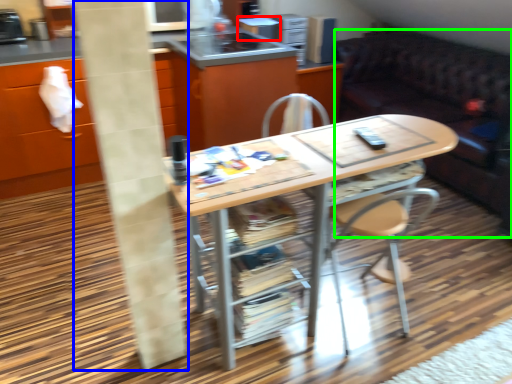
Question: Considering the real-world distances, which object is farthest from appliance (highlighted by a red box)? pillar (highlighted by a blue box) or studio couch (highlighted by a green box)?

Choices:
 (A) pillar
 (B) studio couch

Answer: (A)